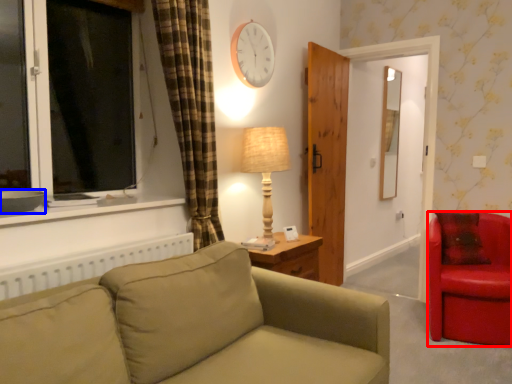
Question: Which point is further to the camera, chair (highlighted by a red box) or bowl (highlighted by a blue box)?

Choices:
 (A) chair
 (B) bowl

Answer: (A)